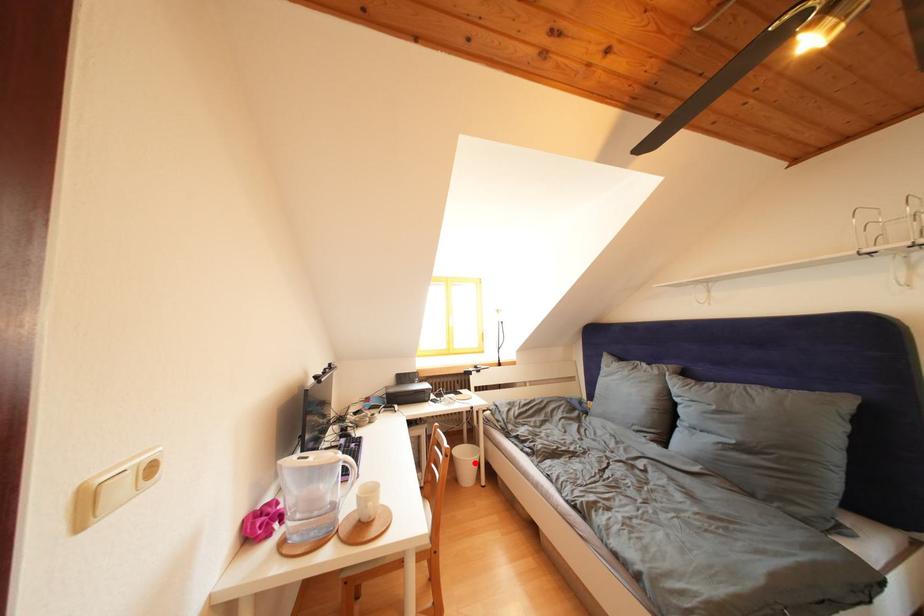
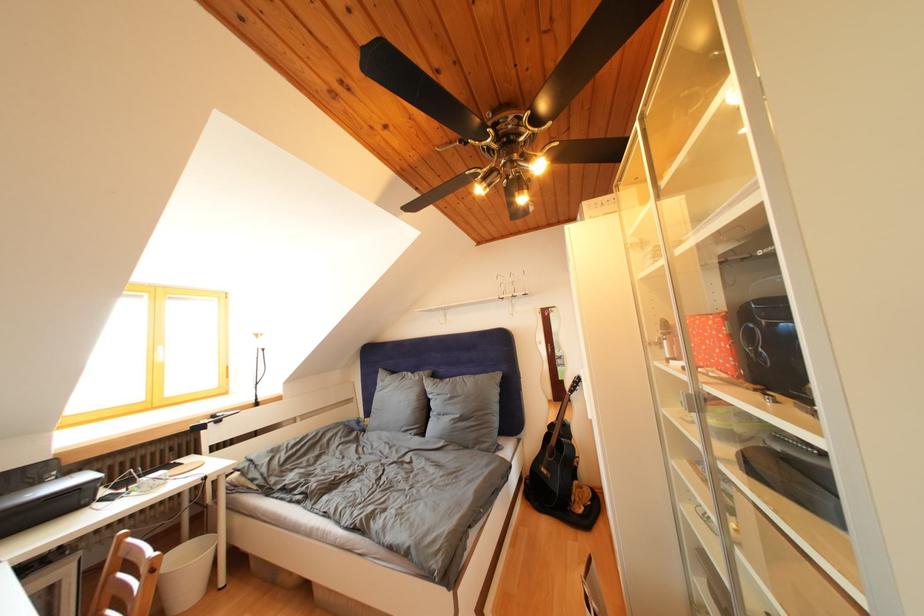
Question: I am providing you with two images of the same scene from different viewpoints. A red point is shown in image1. For the corresponding object point in image2, is it positioned nearer or farther from the camera?

Choices:
 (A) Nearer
 (B) Farther

Answer: (A)